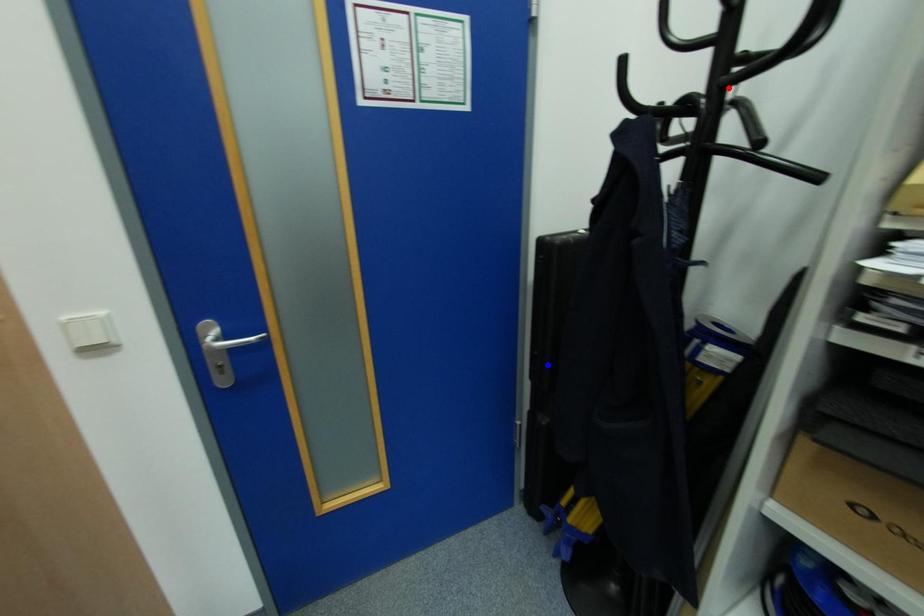
Question: In the image, two points are highlighted. Which point is nearer to the camera? Reply with the corresponding letter.

Choices:
 (A) blue point
 (B) red point

Answer: (B)